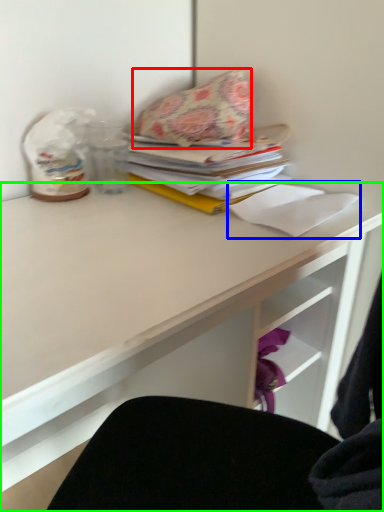
Question: Which object is positioned closest to throw pillow (highlighted by a red box)? Select from paper (highlighted by a blue box) and desk (highlighted by a green box).

Choices:
 (A) paper
 (B) desk

Answer: (A)